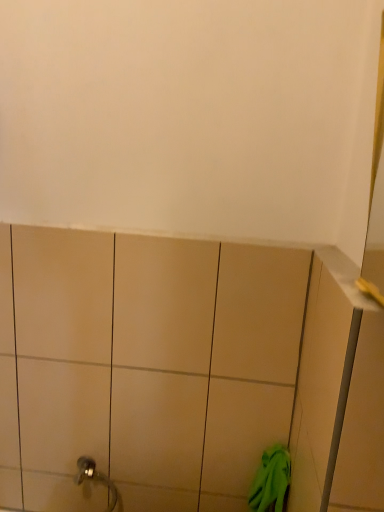
At what (x,y) coordinates should I click in order to perform the action: click on porcelain at lower right. Please return your answer as a coordinate pair (x, y). Looking at the image, I should click on (165, 367).

Describe the element at coordinates (165, 367) in the screenshot. The image size is (384, 512). I see `porcelain at lower right` at that location.

The width and height of the screenshot is (384, 512). Identify the location of porcelain at lower right. 165,367.